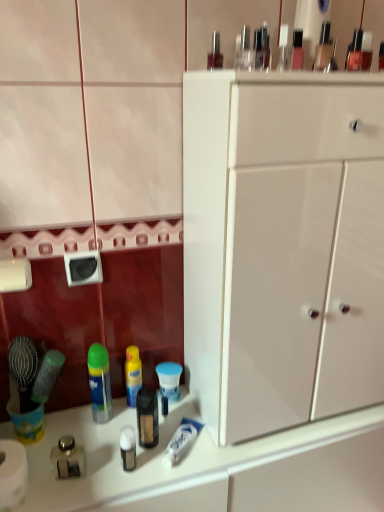
Question: Is white matte toilet paper at lower left in front of or behind white glossy counter top at lower left in the image?

Choices:
 (A) front
 (B) behind

Answer: (A)

Question: Considering the positions of white matte toilet paper at lower left and white glossy counter top at lower left in the image, is white matte toilet paper at lower left taller or shorter than white glossy counter top at lower left?

Choices:
 (A) short
 (B) tall

Answer: (A)

Question: Based on their relative distances, which object is nearer to the white glossy cabinet at center?

Choices:
 (A) clear glass jar at lower left, marked as the 2th toiletry in a right-to-left arrangement
 (B) white glossy counter top at lower left
 (C) white matte toilet paper at lower left
 (D) green plastic mouthwash at center
 (E) blue matte toothpaste tube at lower center, which ranks as the 1th toiletry in back-to-front order

Answer: (B)

Question: Considering the real-world distances, which object is farthest from the white glossy counter top at lower left?

Choices:
 (A) white matte toilet paper at lower left
 (B) clear glass jar at lower left, which is the 1th toiletry in left-to-right order
 (C) green plastic mouthwash at center
 (D) blue matte toothpaste tube at lower center, which is the second toiletry in front-to-back order
 (E) white glossy cabinet at center

Answer: (A)